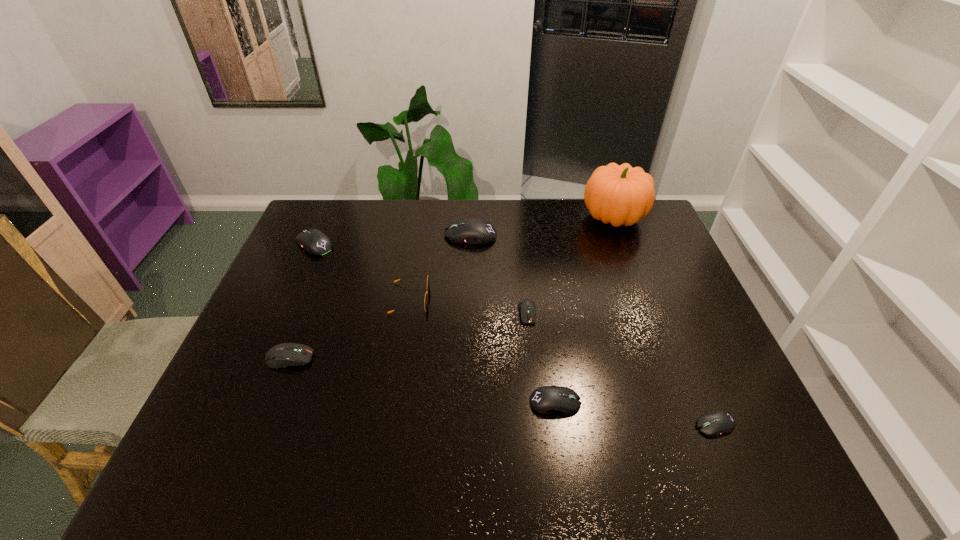
The width and height of the screenshot is (960, 540). In the image, there is a desktop. Identify the location of free space at the right edge. (717, 381).

Locate an element on the screen. vacant space at the far right corner is located at coordinates (x=654, y=210).

Where is `vacant area that lies between the seventh shortest object and the black sunglasses`? vacant area that lies between the seventh shortest object and the black sunglasses is located at coordinates (440, 267).

This screenshot has height=540, width=960. What are the coordinates of `free spot between the second black computer equipment from right to left and the leftmost black computer equipment` in the screenshot? It's located at (435, 323).

You are a GUI agent. You are given a task and a screenshot of the screen. Output one action in this format:
    pyautogui.click(x=<x>, y=<y>)
    Task: Click on the vacant area that lies between the sixth farthest object and the third object from left to right
    
    Given the screenshot: What is the action you would take?
    pyautogui.click(x=349, y=328)

You are a GUI agent. You are given a task and a screenshot of the screen. Output one action in this format:
    pyautogui.click(x=<x>, y=<y>)
    Task: Click on the free space between the second tallest object and the pumpkin
    Image resolution: width=960 pixels, height=540 pixels.
    Given the screenshot: What is the action you would take?
    pyautogui.click(x=541, y=227)

You are a GUI agent. You are given a task and a screenshot of the screen. Output one action in this format:
    pyautogui.click(x=<x>, y=<y>)
    Task: Click on the free space between the smallest black computer equipment and the right dark computer equipment
    Image resolution: width=960 pixels, height=540 pixels.
    Given the screenshot: What is the action you would take?
    pyautogui.click(x=621, y=369)

The image size is (960, 540). Identify the location of free point between the bigger dark computer equipment and the third black computer equipment from left to right. (422, 380).

Identify the location of free space between the rightmost black computer equipment and the left dark computer equipment. The height and width of the screenshot is (540, 960). (502, 392).

At what (x,y) coordinates should I click in order to perform the action: click on empty space that is in between the smaller dark computer equipment and the leftmost black computer equipment. Please return your answer as a coordinate pair (x, y). The width and height of the screenshot is (960, 540). Looking at the image, I should click on [420, 279].